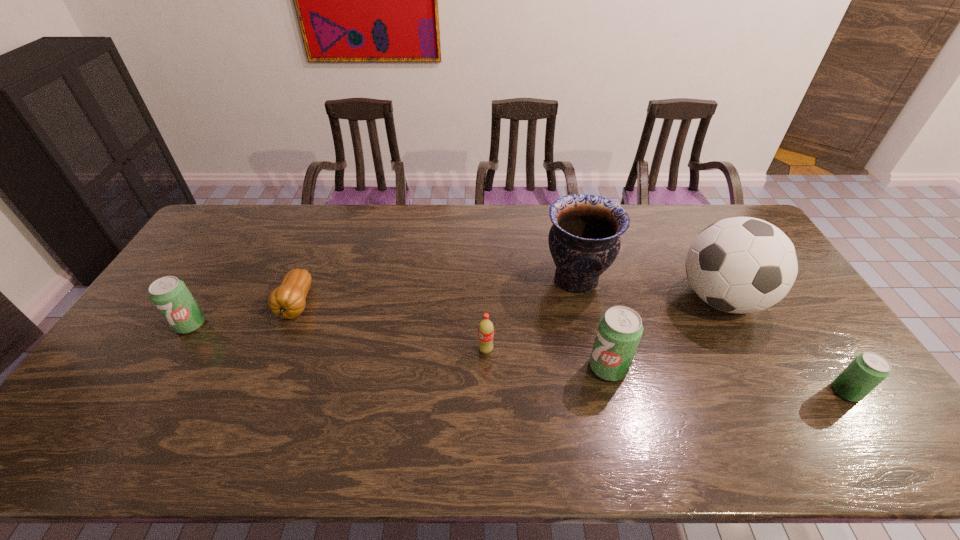
The width and height of the screenshot is (960, 540). Find the location of `object that is the second closest one to the leftmost object`. object that is the second closest one to the leftmost object is located at coordinates (486, 328).

Identify the location of object that is the third nearest to the pottery. Image resolution: width=960 pixels, height=540 pixels. (486, 328).

Select which soda is the second closest to the pottery. Please provide its 2D coordinates. Your answer should be formatted as a tuple, i.e. [(x, y)], where the tuple contains the x and y coordinates of a point satisfying the conditions above.

[(486, 328)]

Image resolution: width=960 pixels, height=540 pixels. I want to click on soda that is the second nearest to the second soda from right to left, so click(869, 369).

This screenshot has width=960, height=540. Find the location of `free space that satisfies the following two spatial constraints: 1. on the front side of the second soda from left to right; 2. on the left side of the leftmost object`. free space that satisfies the following two spatial constraints: 1. on the front side of the second soda from left to right; 2. on the left side of the leftmost object is located at coordinates (175, 350).

Identify the location of vacant space that satisfies the following two spatial constraints: 1. on the front handle of the pottery; 2. on the right side of the third tallest object. The height and width of the screenshot is (540, 960). (596, 367).

Identify the location of vacant area that satisfies the following two spatial constraints: 1. on the front handle of the pottery; 2. on the front side of the third object from left to right. This screenshot has height=540, width=960. (592, 350).

This screenshot has height=540, width=960. Identify the location of vacant region that satisfies the following two spatial constraints: 1. on the front side of the leftmost soda; 2. on the left side of the third object from left to right. (175, 350).

Find the location of a particular element. This screenshot has width=960, height=540. vacant space that satisfies the following two spatial constraints: 1. on the front handle of the pottery; 2. on the right side of the rightmost soda is located at coordinates (602, 392).